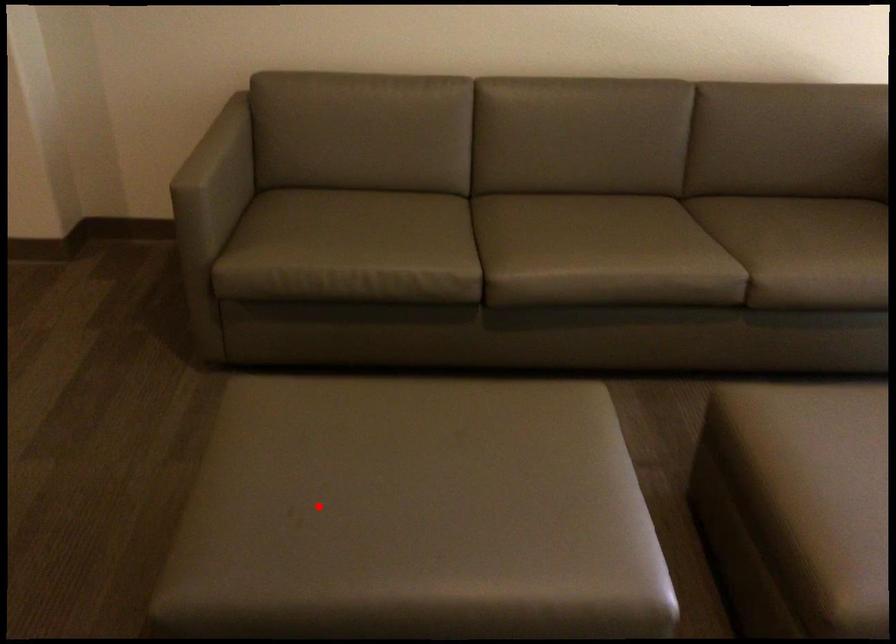
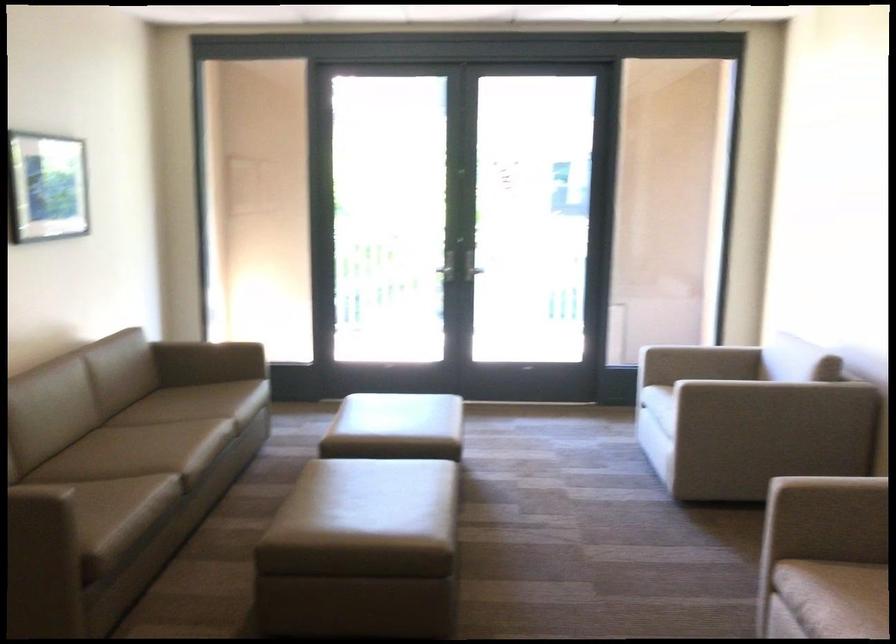
Question: I am providing you with two images of the same scene from different viewpoints. Image1 has a red point marked. In image2, the corresponding 3D location appears at what relative position? Reply with the corresponding letter.

Choices:
 (A) Closer
 (B) Farther

Answer: (B)